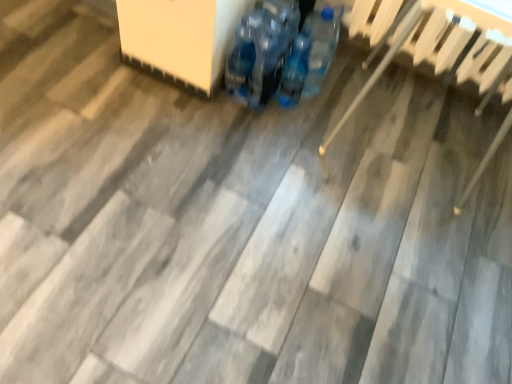
Question: Is blue plastic bottles at center at the left side of wooden chair at right?

Choices:
 (A) yes
 (B) no

Answer: (A)

Question: Can you confirm if blue plastic bottles at center is smaller than wooden chair at right?

Choices:
 (A) yes
 (B) no

Answer: (A)

Question: Is blue plastic bottles at center oriented towards wooden chair at right?

Choices:
 (A) no
 (B) yes

Answer: (A)

Question: Is blue plastic bottles at center to the right of wooden chair at right from the viewer's perspective?

Choices:
 (A) yes
 (B) no

Answer: (B)

Question: Does blue plastic bottles at center have a larger size compared to wooden chair at right?

Choices:
 (A) no
 (B) yes

Answer: (A)

Question: Is blue plastic bottles at center far from wooden chair at right?

Choices:
 (A) yes
 (B) no

Answer: (B)

Question: Does blue plastic bottles at center appear on the left side of blue plastic bottles at center?

Choices:
 (A) yes
 (B) no

Answer: (A)

Question: From a real-world perspective, is blue plastic bottles at center beneath blue plastic bottles at center?

Choices:
 (A) yes
 (B) no

Answer: (B)

Question: Is blue plastic bottles at center oriented towards blue plastic bottles at center?

Choices:
 (A) no
 (B) yes

Answer: (A)

Question: Considering the relative sizes of blue plastic bottles at center and blue plastic bottles at center in the image provided, is blue plastic bottles at center bigger than blue plastic bottles at center?

Choices:
 (A) no
 (B) yes

Answer: (B)

Question: From the image's perspective, is blue plastic bottles at center under blue plastic bottles at center?

Choices:
 (A) no
 (B) yes

Answer: (A)

Question: Considering the relative sizes of blue plastic bottles at center and blue plastic bottles at center in the image provided, is blue plastic bottles at center taller than blue plastic bottles at center?

Choices:
 (A) no
 (B) yes

Answer: (B)

Question: Is blue plastic bottles at center smaller than blue plastic bottles at center?

Choices:
 (A) yes
 (B) no

Answer: (A)